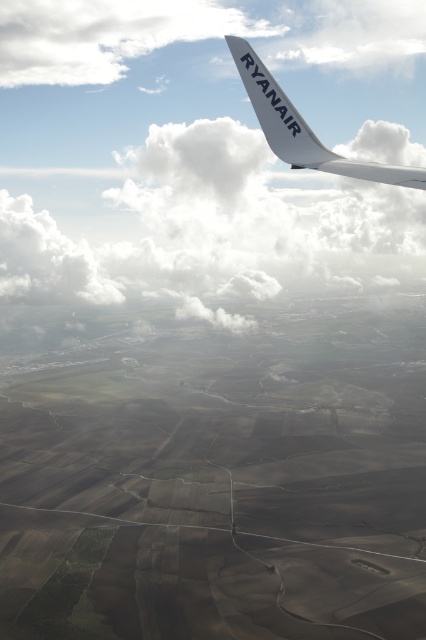
Question: Which of the following is the farthest from the observer?

Choices:
 (A) (406, 177)
 (B) (46, 218)

Answer: (B)

Question: Can you confirm if white fluffy cloud at upper center is positioned above white matte ryanair winglet at upper right?

Choices:
 (A) no
 (B) yes

Answer: (B)

Question: Is white matte ryanair winglet at upper right below white matte wing at upper center?

Choices:
 (A) no
 (B) yes

Answer: (B)

Question: Which of the following is the closest to the observer?

Choices:
 (A) white matte ryanair winglet at upper right
 (B) white matte wing at upper center

Answer: (A)

Question: Estimate the real-world distances between objects in this image. Which object is farther from the white matte ryanair winglet at upper right?

Choices:
 (A) white fluffy cloud at upper center
 (B) white matte wing at upper center

Answer: (A)

Question: Is white matte ryanair winglet at upper right wider than white matte wing at upper center?

Choices:
 (A) no
 (B) yes

Answer: (B)